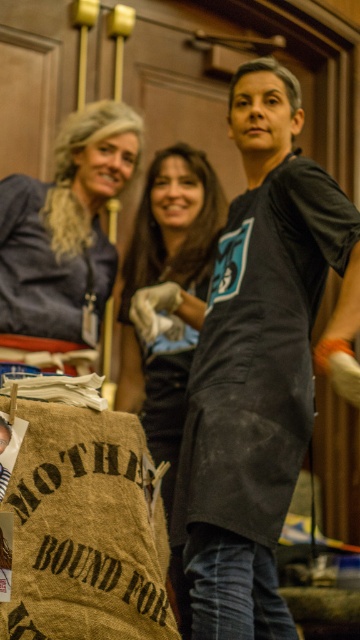
Can you confirm if matte blue shirt at left is positioned to the right of black matte shirt at center?

Incorrect, matte blue shirt at left is not on the right side of black matte shirt at center.

Is matte blue shirt at left closer to the viewer compared to black matte shirt at center?

No, matte blue shirt at left is behind black matte shirt at center.

Does point (92, 212) come in front of point (162, 364)?

No.

At what (x,y) coordinates should I click in order to perform the action: click on matte blue shirt at left. Please return your answer as a coordinate pair (x, y). This screenshot has width=360, height=640. Looking at the image, I should click on (65, 230).

Which is more to the left, black matte apron at center or matte blue shirt at left?

From the viewer's perspective, matte blue shirt at left appears more on the left side.

Between point (275, 413) and point (102, 280), which one is positioned in front?

Point (275, 413)

Where is `black matte apron at center`? black matte apron at center is located at coordinates (258, 362).

The width and height of the screenshot is (360, 640). Find the location of `black matte apron at center`. black matte apron at center is located at coordinates (258, 362).

Which of these two, black matte apron at center or black matte shirt at center, stands taller?

Standing taller between the two is black matte shirt at center.

Find the location of a particular element. The height and width of the screenshot is (640, 360). black matte apron at center is located at coordinates (258, 362).

Image resolution: width=360 pixels, height=640 pixels. Identify the location of black matte apron at center. (258, 362).